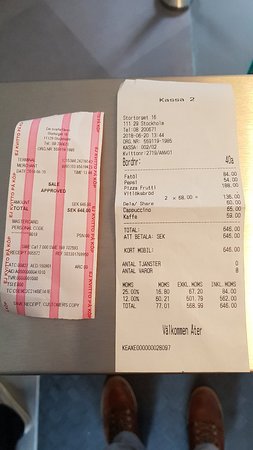
At what (x,y) coordinates should I click in order to perform the action: click on floor. Please return your answer as a coordinate pair (x, y). Looking at the image, I should click on (75, 401).